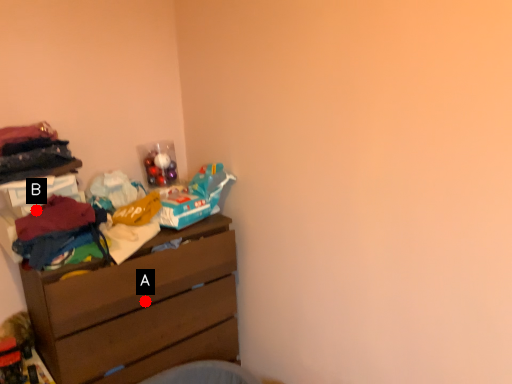
Question: Two points are circled on the image, labeled by A and B beside each circle. Which point is farther to the camera?

Choices:
 (A) A is further
 (B) B is further

Answer: (A)